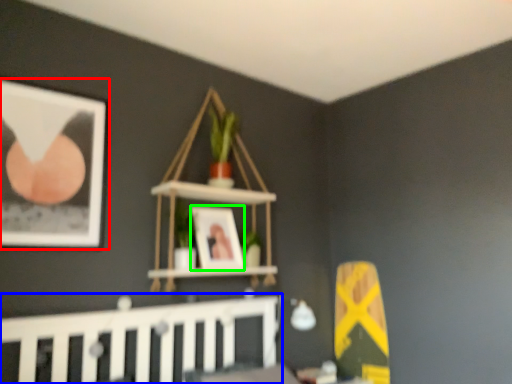
Question: Based on their relative distances, which object is nearer to picture frame (highlighted by a red box)? Choose from rail (highlighted by a blue box) and picture frame (highlighted by a green box).

Choices:
 (A) rail
 (B) picture frame

Answer: (A)